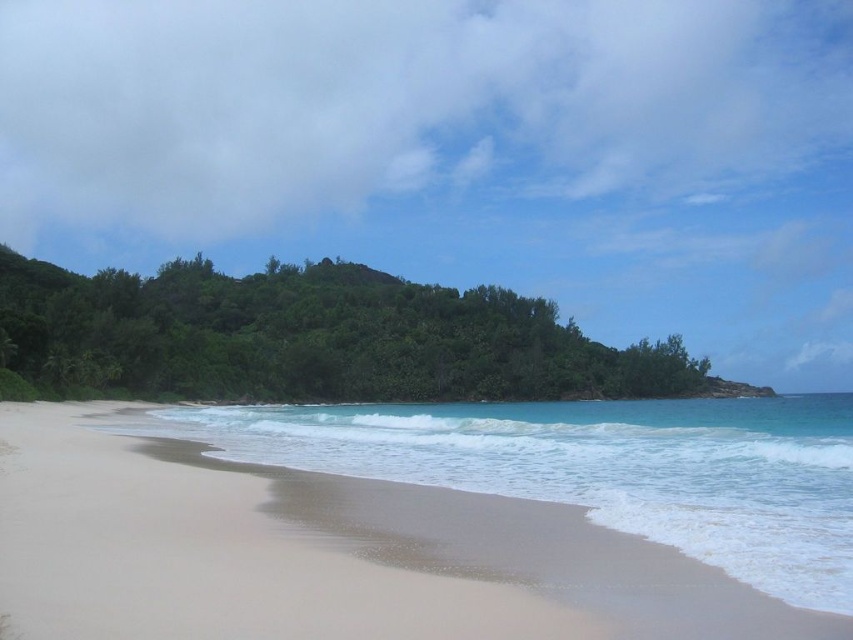
Question: Does green leafy island at center appear over clear blue water at lower center?

Choices:
 (A) no
 (B) yes

Answer: (B)

Question: Does green leafy island at center have a greater width compared to clear blue water at lower center?

Choices:
 (A) no
 (B) yes

Answer: (B)

Question: Can you confirm if green leafy island at center is positioned below clear blue water at lower center?

Choices:
 (A) yes
 (B) no

Answer: (B)

Question: Which object appears farthest from the camera in this image?

Choices:
 (A) clear blue water at lower center
 (B) green leafy island at center

Answer: (B)

Question: Which point is closer to the camera?

Choices:
 (A) clear blue water at lower center
 (B) green leafy island at center

Answer: (A)